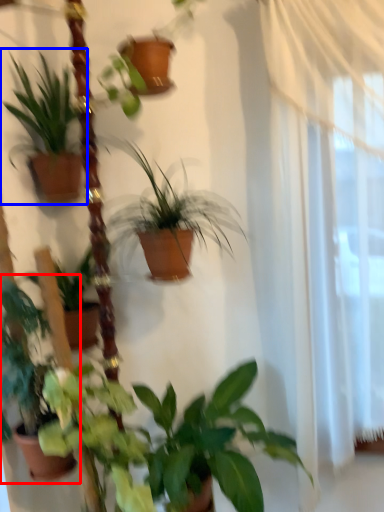
Question: Which of the following is the farthest to the observer, houseplant (highlighted by a red box) or houseplant (highlighted by a blue box)?

Choices:
 (A) houseplant
 (B) houseplant

Answer: (B)